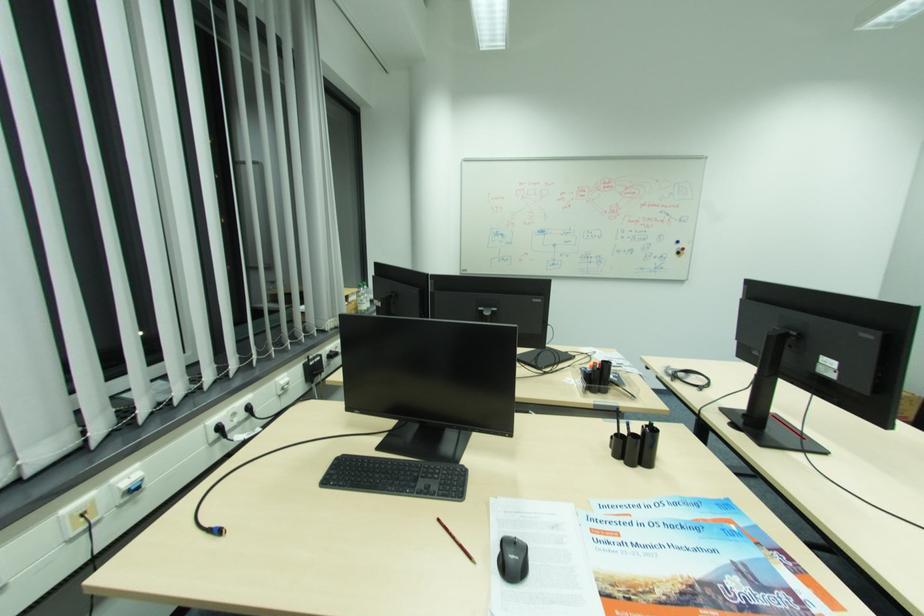
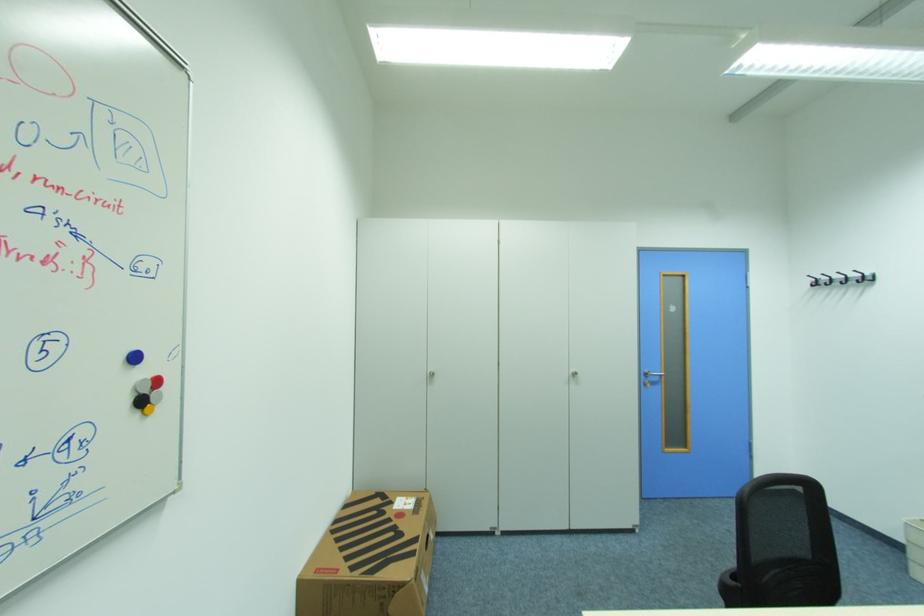
Where in the second image is the point corresponding to (684,241) from the first image?

(140, 359)